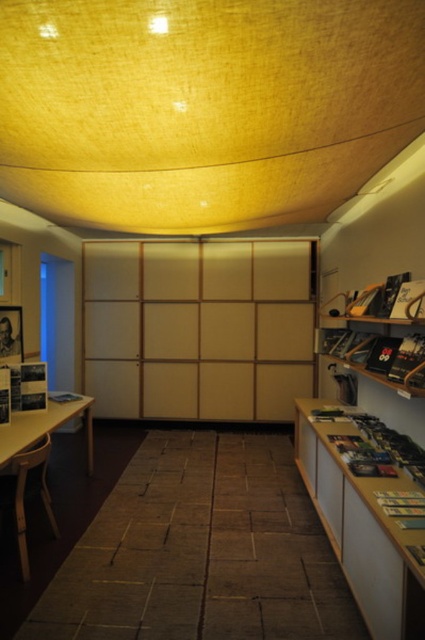
You are standing in the room and want to take a photo of both point (42, 433) and point (50, 406). Which point should you focus on first to ensure both are in clear view?

You should focus on point (42, 433) first since it is closer to the camera than point (50, 406). This ensures both points are in focus as the depth of field will cover the farther point as well.

You are standing in the room and want to take a photo of both point [414,465] and point [90,417]. Which point should you focus on first to ensure both are in focus?

You should focus on point [90,417] first because it is farther from the camera than point [414,465], ensuring the depth of field captures both points.

You are standing in the center of the room and want to place a new book on the wooden bookshelf at right. Based on its coordinates, in which direction should you move to reach it?

The wooden bookshelf at right is located at coordinates point (371, 472), which means it is positioned to the right and slightly below your current position at the center. You should move towards the right and downward to reach it.